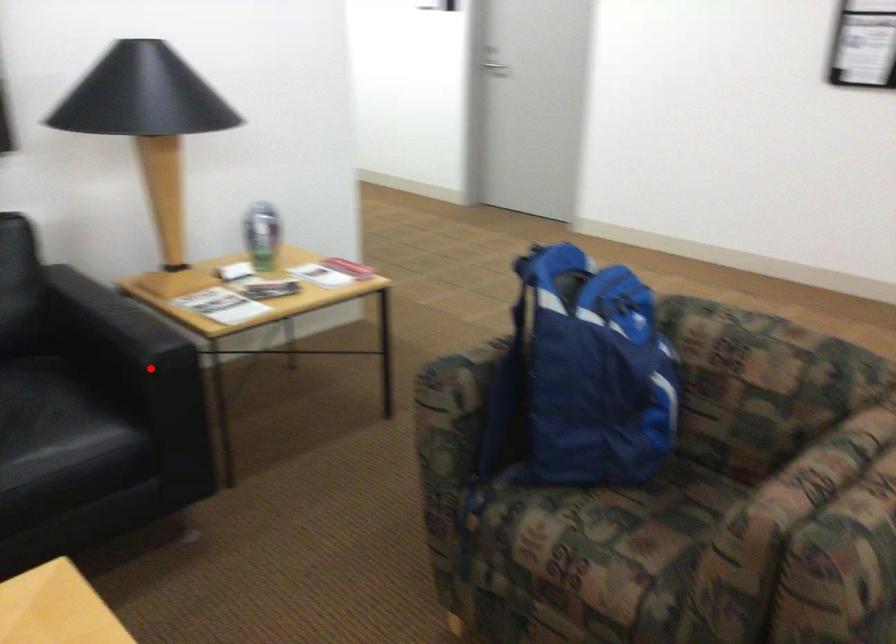
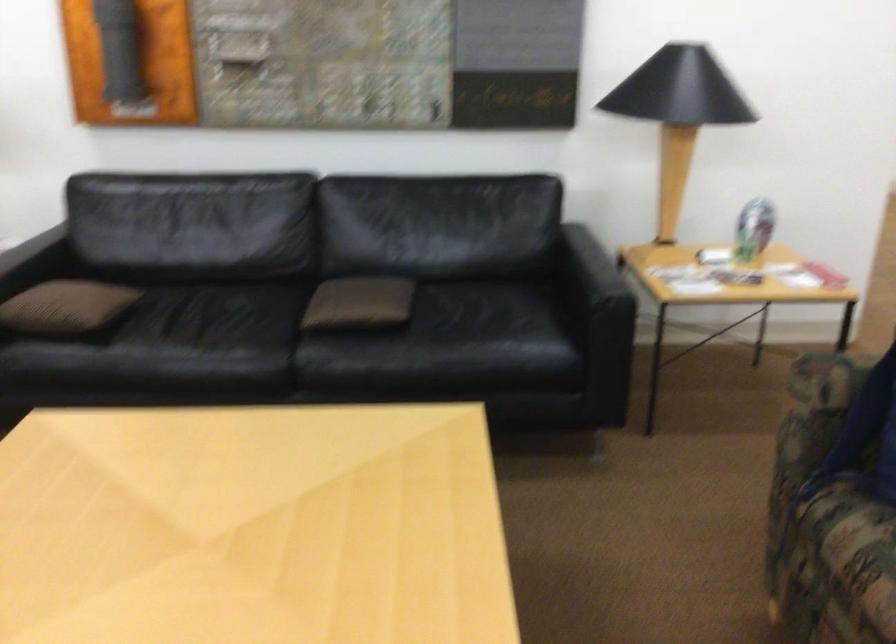
Where in the second image is the point corresponding to the highlighted location from the first image?

(599, 306)